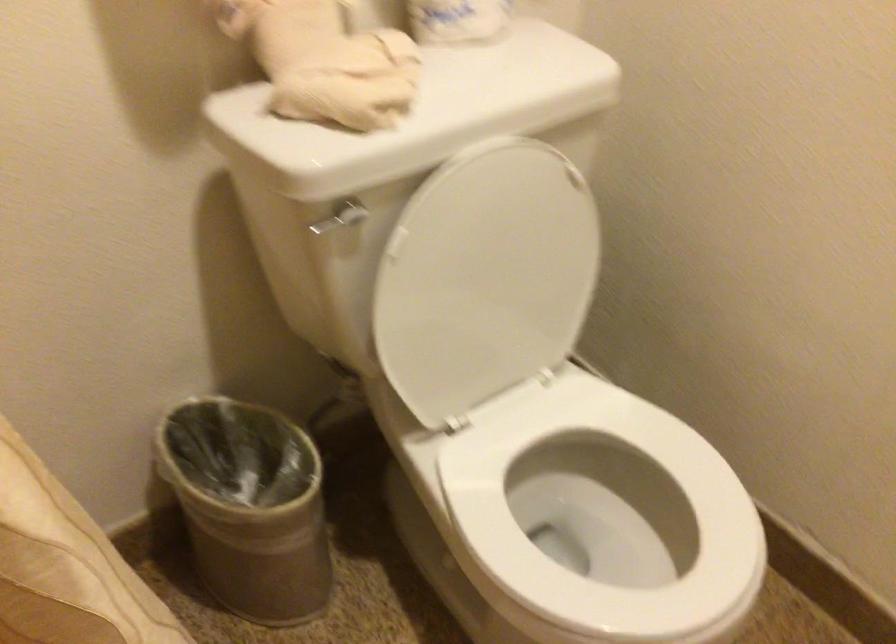
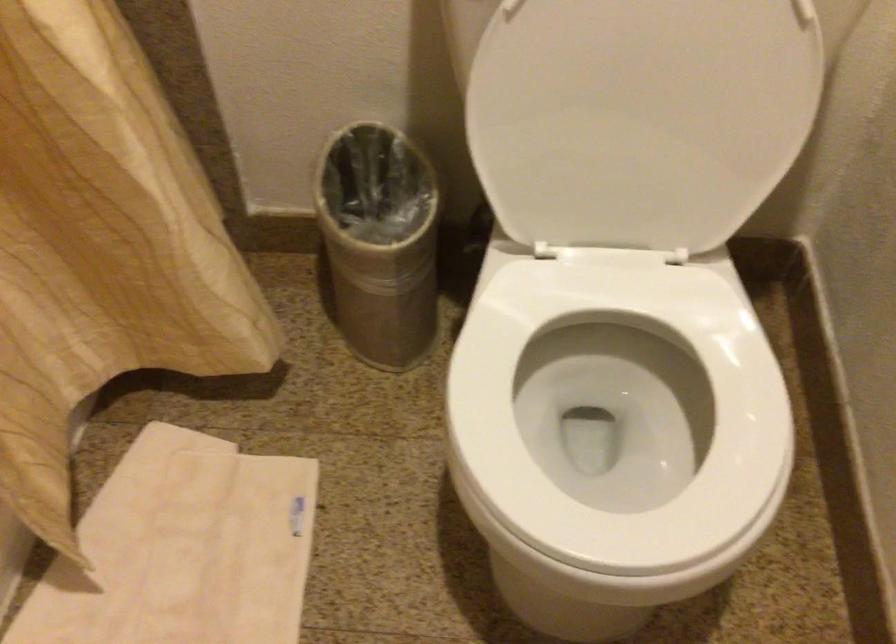
Locate, in the second image, the point that corresponds to (x=496, y=290) in the first image.

(640, 118)